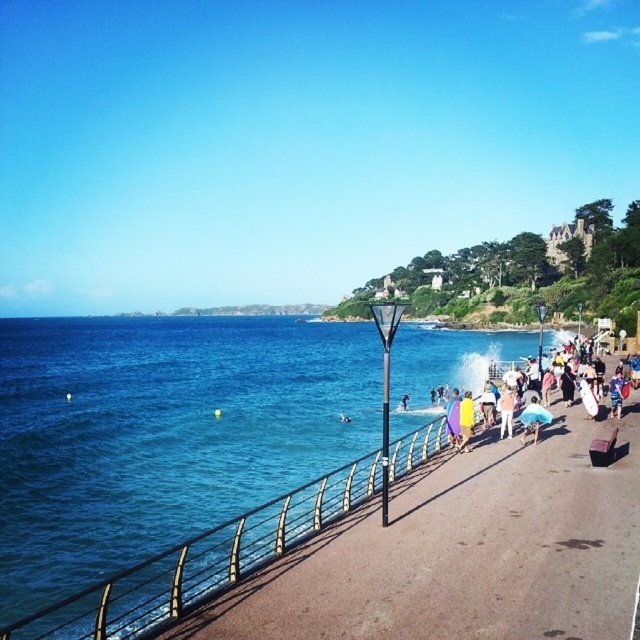
You are a beachgoer who wants to set up a beach towel. You have a yellow fabric umbrella at center and a purple fabric at center in your bag. Which fabric item should you choose to provide more shade coverage for your towel?

The purple fabric at center should be chosen as it is larger than the yellow fabric umbrella at center, providing more shade coverage.